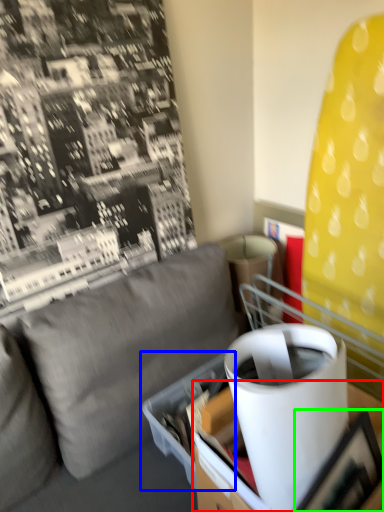
Question: Based on their relative distances, which object is farther from table (highlighted by a red box)? Choose from cardboard box (highlighted by a blue box) and picture frame (highlighted by a green box).

Choices:
 (A) cardboard box
 (B) picture frame

Answer: (B)